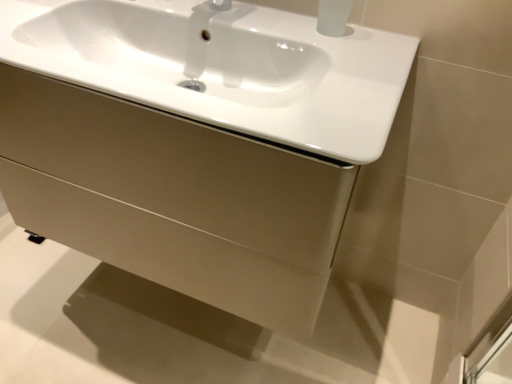
What do you see at coordinates (176, 168) in the screenshot? The image size is (512, 384). I see `matte beige drawer at center` at bounding box center [176, 168].

The width and height of the screenshot is (512, 384). Identify the location of matte beige drawer at center. [x=176, y=168].

This screenshot has width=512, height=384. What do you see at coordinates (223, 66) in the screenshot?
I see `white glossy sink at center` at bounding box center [223, 66].

The width and height of the screenshot is (512, 384). Identify the location of white glossy sink at center. (223, 66).

The width and height of the screenshot is (512, 384). I want to click on matte beige drawer at center, so click(x=176, y=168).

Considering the positions of objects white glossy sink at center and matte beige drawer at center in the image provided, who is more to the left, white glossy sink at center or matte beige drawer at center?

matte beige drawer at center is more to the left.

From the picture: Between white glossy sink at center and matte beige drawer at center, which one is positioned in front?

white glossy sink at center is more forward.

Is point (412, 46) closer to viewer compared to point (87, 119)?

No, (412, 46) is behind (87, 119).

Based on the photo, from the image's perspective, is white glossy sink at center located beneath matte beige drawer at center?

No, from the image's perspective, white glossy sink at center is not beneath matte beige drawer at center.

From a real-world perspective, who is located lower, white glossy sink at center or matte beige drawer at center?

matte beige drawer at center.

Can you confirm if white glossy sink at center is wider than matte beige drawer at center?

No.

Who is taller, white glossy sink at center or matte beige drawer at center?

matte beige drawer at center is taller.

Considering the sizes of white glossy sink at center and matte beige drawer at center in the image, is white glossy sink at center bigger or smaller than matte beige drawer at center?

Clearly, white glossy sink at center is smaller in size than matte beige drawer at center.

Do you think white glossy sink at center is within matte beige drawer at center, or outside of it?

white glossy sink at center is located inside matte beige drawer at center.

Is white glossy sink at center next to matte beige drawer at center?

white glossy sink at center and matte beige drawer at center are not in contact.

Is white glossy sink at center oriented towards matte beige drawer at center?

Yes.

How distant is white glossy sink at center from matte beige drawer at center?

white glossy sink at center is 6.92 inches away from matte beige drawer at center.

The width and height of the screenshot is (512, 384). I want to click on drawer directly beneath the white glossy sink at center (from a real-world perspective), so click(x=176, y=168).

Between matte beige drawer at center and white glossy sink at center, which one appears on the right side from the viewer's perspective?

white glossy sink at center is more to the right.

Considering the positions of objects matte beige drawer at center and white glossy sink at center in the image provided, who is in front, matte beige drawer at center or white glossy sink at center?

white glossy sink at center is in front.

Considering the points (218, 214) and (33, 53), which point is in front, point (218, 214) or point (33, 53)?

The point (33, 53) is more forward.

From the image's perspective, is matte beige drawer at center above or below white glossy sink at center?

From the image's perspective, matte beige drawer at center appears below white glossy sink at center.

From a real-world perspective, is matte beige drawer at center positioned under white glossy sink at center based on gravity?

Indeed, from a real-world perspective, matte beige drawer at center is positioned beneath white glossy sink at center.

Is matte beige drawer at center wider or thinner than white glossy sink at center?

Clearly, matte beige drawer at center has more width compared to white glossy sink at center.

Is matte beige drawer at center taller than white glossy sink at center?

Yes.

Is matte beige drawer at center bigger than white glossy sink at center?

Yes.

Would you say matte beige drawer at center contains white glossy sink at center?

Yes, white glossy sink at center is a part of matte beige drawer at center.

Would you consider matte beige drawer at center to be distant from white glossy sink at center?

No, matte beige drawer at center is not far from white glossy sink at center.

Is matte beige drawer at center facing towards white glossy sink at center?

No.

How distant is matte beige drawer at center from white glossy sink at center?

They are 17.57 centimeters apart.

Find the location of a particular element. The width and height of the screenshot is (512, 384). sink in front of the matte beige drawer at center is located at coordinates (223, 66).

I want to click on drawer located underneath the white glossy sink at center (from a real-world perspective), so click(x=176, y=168).

This screenshot has height=384, width=512. Find the location of `sink located above the matte beige drawer at center (from a real-world perspective)`. sink located above the matte beige drawer at center (from a real-world perspective) is located at coordinates (223, 66).